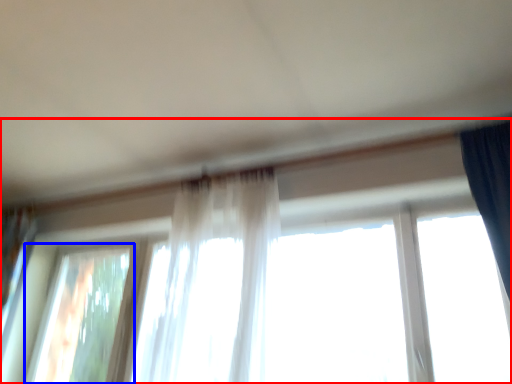
Question: Which object appears farthest to the camera in this image, window (highlighted by a red box) or window (highlighted by a blue box)?

Choices:
 (A) window
 (B) window

Answer: (B)